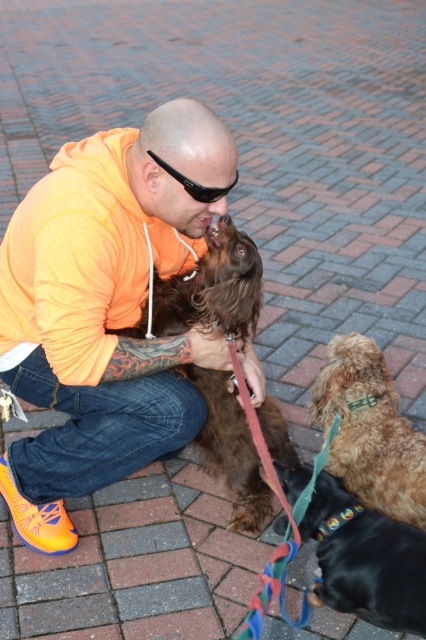
Question: Is orange hoodie at center smaller than black plastic sunglasses at upper center?

Choices:
 (A) yes
 (B) no

Answer: (B)

Question: Is shiny brown fur at lower right to the right of black plastic sunglasses at upper center from the viewer's perspective?

Choices:
 (A) yes
 (B) no

Answer: (A)

Question: Which point is closer to the camera taking this photo?

Choices:
 (A) (213, 188)
 (B) (362, 451)
 (C) (161, 368)

Answer: (A)

Question: Which point is closer to the camera?

Choices:
 (A) brown furry dog at center
 (B) shiny black dog at lower right
 (C) shiny brown fur at lower right

Answer: (B)

Question: Is orange hoodie at center positioned at the back of black plastic sunglasses at upper center?

Choices:
 (A) no
 (B) yes

Answer: (A)

Question: Estimate the real-world distances between objects in this image. Which object is closer to the orange hoodie at center?

Choices:
 (A) shiny black dog at lower right
 (B) brown furry dog at center
 (C) black plastic sunglasses at upper center
 (D) shiny brown fur at lower right

Answer: (B)